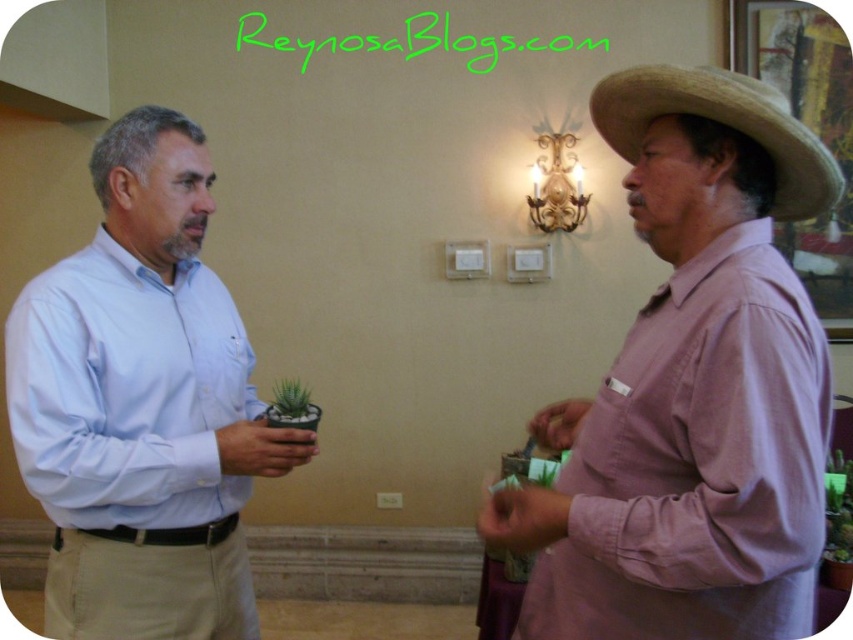
Based on the photo, you are a painter standing in the room and want to paint the light blue shirt at left and the green succulent at center. Which object should you focus on first if you want to paint the one closer to you?

You should focus on the light blue shirt at left first because it is in front of the green succulent at center, making it closer to you.

You are standing in the room and want to reach the light switches below the decorative wall sconce. The light blue shirt at left is represented by point (142, 404). Is the light blue shirt at left closer to the light switches than the person on the right?

The light blue shirt at left is represented by point (142, 404), so the light blue shirt at left is closer to the light switches than the person on the right.

You are standing in the room and want to locate the light blue shirt at left. According to the coordinates provided, where should you look?

You should look at point (142, 404) to find the light blue shirt at left.